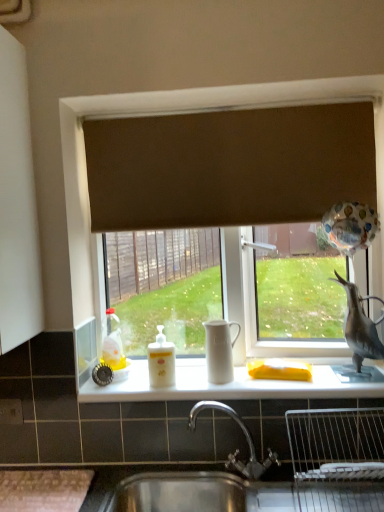
Where is `free spot above brown fabric curtain at upper center (from a real-world perspective)`? free spot above brown fabric curtain at upper center (from a real-world perspective) is located at coordinates (210, 112).